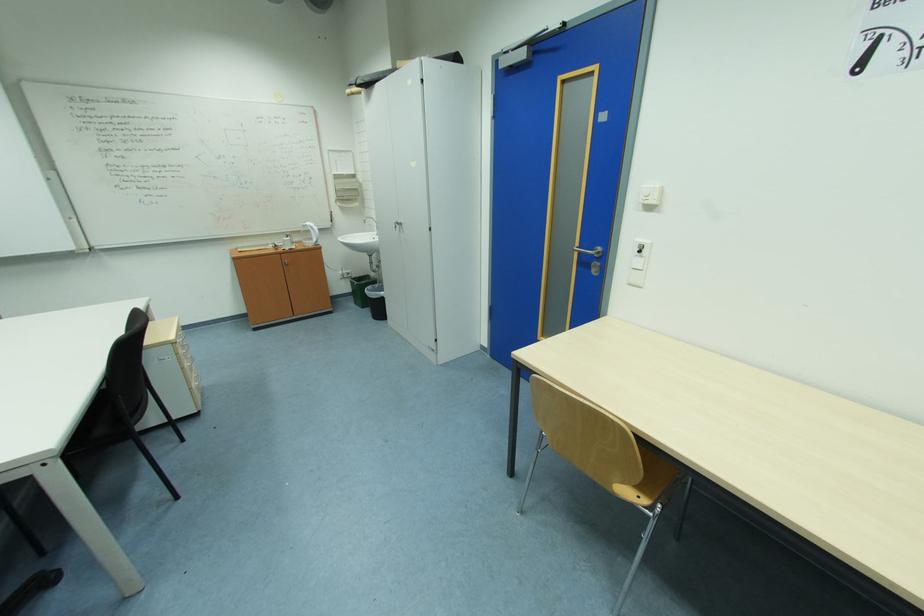
You are a GUI agent. You are given a task and a screenshot of the screen. Output one action in this format:
    pyautogui.click(x=<x>, y=<y>)
    Task: Click on the sink faucet handle
    The image size is (924, 616).
    Given the screenshot: What is the action you would take?
    pyautogui.click(x=370, y=220)